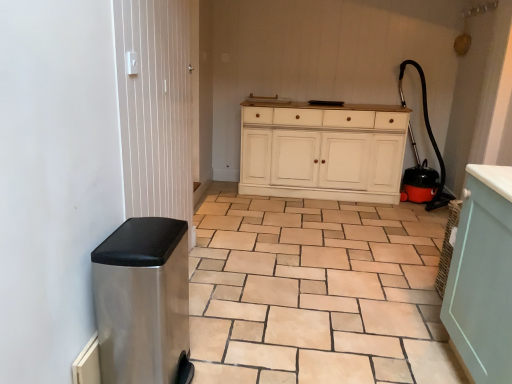
You are a GUI agent. You are given a task and a screenshot of the screen. Output one action in this format:
    pyautogui.click(x=<x>, y=<y>)
    Task: Click on the vacant space to the right of metallic silver screen door at left
    
    Given the screenshot: What is the action you would take?
    pyautogui.click(x=254, y=294)